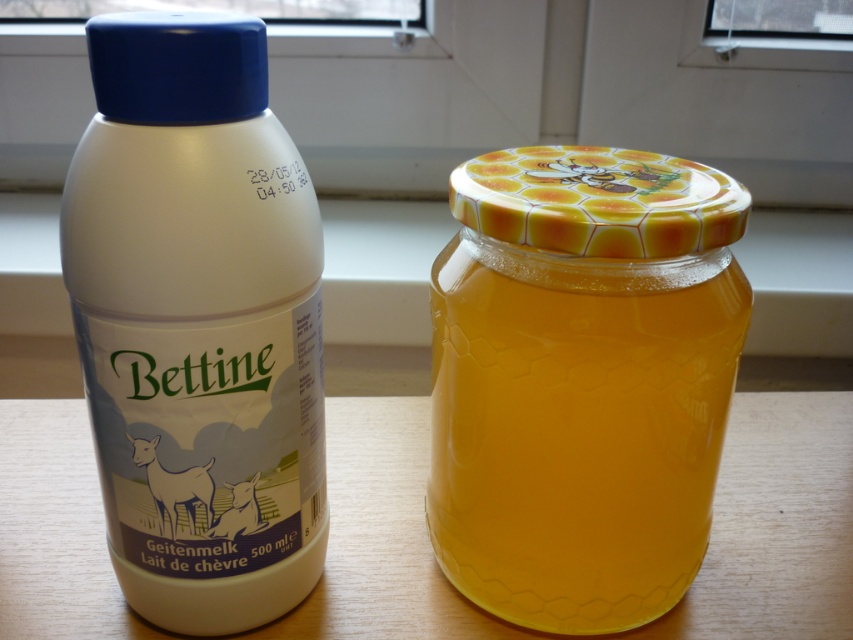
How much distance is there between white matte plastic bottle at center and translucent yellow honey at center?

They are 5.98 inches apart.

Is point (231, 198) positioned in front of point (602, 627)?

Yes, point (231, 198) is in front of point (602, 627).

Is point (171, 88) positioned before point (566, 525)?

Yes, it is in front of point (566, 525).

You are a GUI agent. You are given a task and a screenshot of the screen. Output one action in this format:
    pyautogui.click(x=<x>, y=<y>)
    Task: Click on the white matte plastic bottle at center
    The height and width of the screenshot is (640, 853).
    Given the screenshot: What is the action you would take?
    pyautogui.click(x=194, y=298)

Is translucent yellow honey at center shorter than wooden table at center?

No.

Describe the element at coordinates (577, 428) in the screenshot. I see `translucent yellow honey at center` at that location.

Is point (654, 500) positioned after point (62, 529)?

No, (654, 500) is in front of (62, 529).

At what (x,y) coordinates should I click in order to perform the action: click on translucent yellow honey at center. Please return your answer as a coordinate pair (x, y). Looking at the image, I should click on (577, 428).

Which is more to the left, white matte plastic bottle at center or wooden table at center?

white matte plastic bottle at center is more to the left.

Does white matte plastic bottle at center appear over wooden table at center?

Yes.

Who is more forward, (x=149, y=300) or (x=831, y=586)?

Point (x=149, y=300)

You are a GUI agent. You are given a task and a screenshot of the screen. Output one action in this format:
    pyautogui.click(x=<x>, y=<y>)
    Task: Click on the white matte plastic bottle at center
    The height and width of the screenshot is (640, 853).
    Given the screenshot: What is the action you would take?
    pyautogui.click(x=194, y=298)